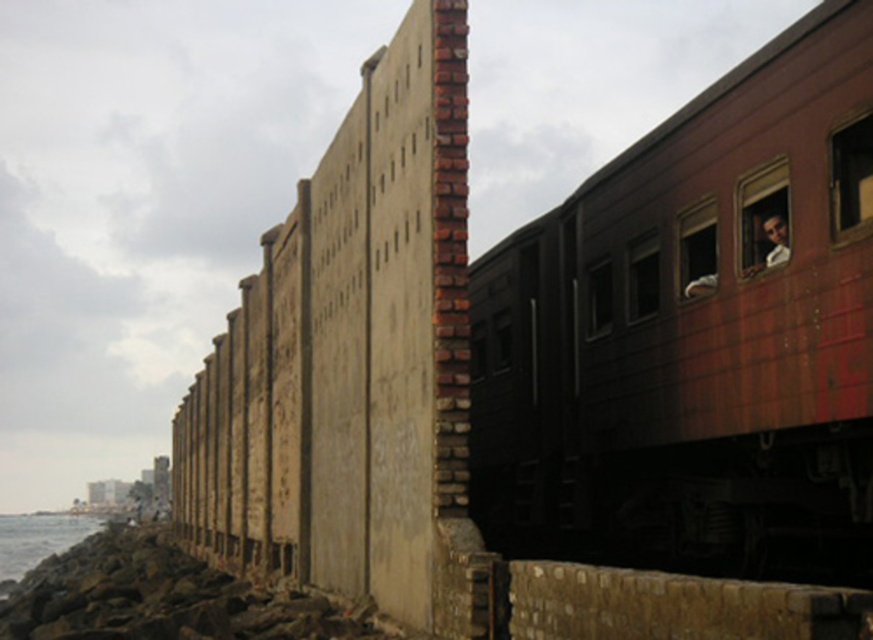
Between rusty metal train at right and gray rocky water at lower left, which one appears on the right side from the viewer's perspective?

rusty metal train at right is more to the right.

The image size is (873, 640). Identify the location of rusty metal train at right. (695, 332).

Find the location of a particular element. The width and height of the screenshot is (873, 640). rusty metal train at right is located at coordinates [x=695, y=332].